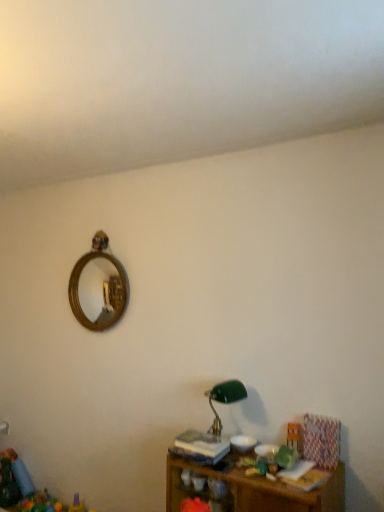
At what (x,y) coordinates should I click in order to perform the action: click on wooden shelf at lower right. Please return your answer as a coordinate pair (x, y). Image resolution: width=384 pixels, height=512 pixels. Looking at the image, I should click on (252, 489).

Find the location of `wooden toy at lower right`. wooden toy at lower right is located at coordinates (294, 436).

This screenshot has width=384, height=512. What are the coordinates of `wooden shelf at lower right` in the screenshot? It's located at [x=252, y=489].

Considering the relative sizes of green glass table lamp at lower center and wooden shelf at lower right in the image provided, is green glass table lamp at lower center wider than wooden shelf at lower right?

No, green glass table lamp at lower center is not wider than wooden shelf at lower right.

Which of these two, green glass table lamp at lower center or wooden shelf at lower right, stands shorter?

With less height is green glass table lamp at lower center.

Is point (218, 386) behind point (222, 476)?

Yes, it is behind point (222, 476).

Is green glass table lamp at lower center smaller than wooden shelf at lower right?

Correct, green glass table lamp at lower center occupies less space than wooden shelf at lower right.

From the image's perspective, which object appears higher, green glass table lamp at lower center or wooden toy at lower right?

green glass table lamp at lower center.

Which of these two, green glass table lamp at lower center or wooden toy at lower right, stands shorter?

With less height is wooden toy at lower right.

Between point (209, 401) and point (292, 447), which one is positioned in front?

The point (292, 447) is in front.

From the image's perspective, between wooden shelf at lower right and wooden toy at lower right, who is located below?

wooden shelf at lower right is shown below in the image.

Where is `shelf below the wooden toy at lower right (from a real-world perspective)`? shelf below the wooden toy at lower right (from a real-world perspective) is located at coordinates (252, 489).

From the picture: Which is in front, wooden shelf at lower right or wooden toy at lower right?

wooden shelf at lower right is in front.

Is wooden shelf at lower right aimed at wooden toy at lower right?

No, wooden shelf at lower right is not aimed at wooden toy at lower right.

Is point (246, 489) closer to viewer compared to point (216, 388)?

Yes.

From the image's perspective, does wooden shelf at lower right appear lower than green glass table lamp at lower center?

Yes, from the image's perspective, wooden shelf at lower right is beneath green glass table lamp at lower center.

Would you say wooden shelf at lower right is a long distance from green glass table lamp at lower center?

No.

Looking at this image, is wooden toy at lower right spatially inside wooden shelf at lower right, or outside of it?

wooden toy at lower right lies outside wooden shelf at lower right.

From the image's perspective, who appears lower, wooden toy at lower right or wooden shelf at lower right?

wooden shelf at lower right is shown below in the image.

Which of these two, wooden toy at lower right or wooden shelf at lower right, is thinner?

With smaller width is wooden toy at lower right.

Considering the relative sizes of wooden toy at lower right and wooden shelf at lower right in the image provided, is wooden toy at lower right shorter than wooden shelf at lower right?

Yes.

Between wooden toy at lower right and green glass table lamp at lower center, which one is positioned behind?

wooden toy at lower right.

Can you tell me how much wooden toy at lower right and green glass table lamp at lower center differ in facing direction?

The angle between the facing direction of wooden toy at lower right and the facing direction of green glass table lamp at lower center is 0.422 degrees.

From the picture: In terms of width, does wooden toy at lower right look wider or thinner when compared to green glass table lamp at lower center?

Clearly, wooden toy at lower right has less width compared to green glass table lamp at lower center.

Is wooden toy at lower right far from green glass table lamp at lower center?

wooden toy at lower right is actually quite close to green glass table lamp at lower center.

Identify the location of shelf below the green glass table lamp at lower center (from a real-world perspective). This screenshot has height=512, width=384. (252, 489).

You are a GUI agent. You are given a task and a screenshot of the screen. Output one action in this format:
    pyautogui.click(x=<x>, y=<y>)
    Task: Click on the table lamp above the wooden toy at lower right (from a real-world perspective)
    The height and width of the screenshot is (512, 384).
    Given the screenshot: What is the action you would take?
    pyautogui.click(x=224, y=400)

Based on their spatial positions, is wooden toy at lower right or green glass table lamp at lower center closer to wooden shelf at lower right?

The object closer to wooden shelf at lower right is wooden toy at lower right.

When comparing their distances from green glass table lamp at lower center, does wooden toy at lower right or wooden shelf at lower right seem closer?

wooden toy at lower right lies closer to green glass table lamp at lower center than the other object.

From the image, which object appears to be farther from wooden toy at lower right, green glass table lamp at lower center or wooden shelf at lower right?

wooden shelf at lower right lies further to wooden toy at lower right than the other object.

Based on their spatial positions, is green glass table lamp at lower center or wooden toy at lower right further from wooden shelf at lower right?

green glass table lamp at lower center is further to wooden shelf at lower right.

Estimate the real-world distances between objects in this image. Which object is closer to wooden toy at lower right, wooden shelf at lower right or green glass table lamp at lower center?

Among the two, green glass table lamp at lower center is located nearer to wooden toy at lower right.

Estimate the real-world distances between objects in this image. Which object is further from green glass table lamp at lower center, wooden shelf at lower right or wooden toy at lower right?

wooden shelf at lower right is further to green glass table lamp at lower center.

I want to click on table lamp positioned between wooden shelf at lower right and wooden toy at lower right from near to far, so click(x=224, y=400).